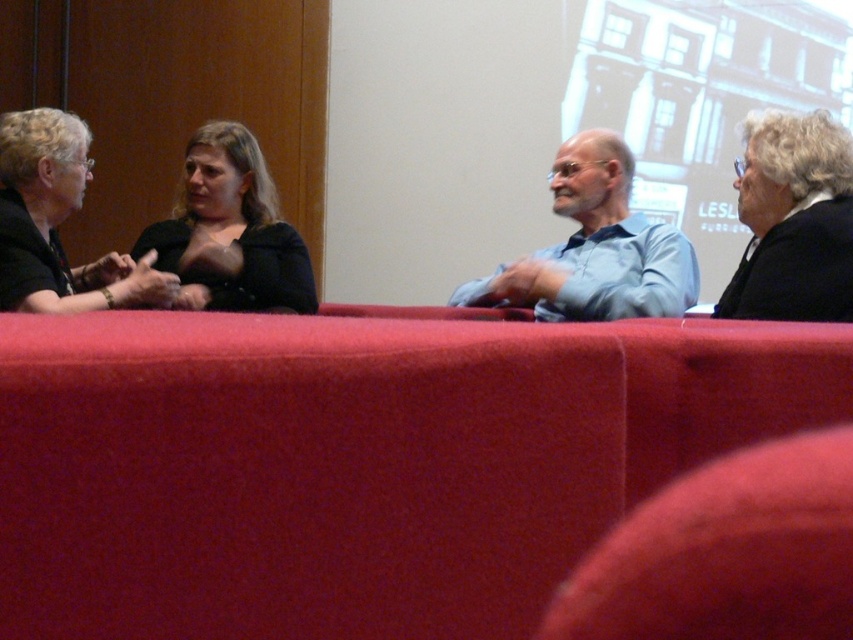
Measure the distance from black woolen jacket at right to matte black jacket at left.

A distance of 4.70 feet exists between black woolen jacket at right and matte black jacket at left.

Is black woolen jacket at right shorter than matte black jacket at left?

Correct, black woolen jacket at right is not as tall as matte black jacket at left.

Is point (837, 257) in front of point (20, 216)?

Yes, it is.

You are a GUI agent. You are given a task and a screenshot of the screen. Output one action in this format:
    pyautogui.click(x=<x>, y=<y>)
    Task: Click on the black woolen jacket at right
    
    Given the screenshot: What is the action you would take?
    pyautogui.click(x=793, y=220)

Can you confirm if light blue shirt at center is thinner than matte black jacket at left?

No.

Does light blue shirt at center appear under matte black jacket at left?

No, light blue shirt at center is not below matte black jacket at left.

Does point (486, 284) come farther from viewer compared to point (9, 148)?

Yes.

Find the location of a particular element. light blue shirt at center is located at coordinates (595, 248).

Consider the image. Is light blue shirt at center to the right of matte black shirt at center from the viewer's perspective?

Yes, light blue shirt at center is to the right of matte black shirt at center.

Which is above, light blue shirt at center or matte black shirt at center?

light blue shirt at center

Is point (593, 289) farther from camera compared to point (207, 276)?

No, (593, 289) is closer to viewer.

You are a GUI agent. You are given a task and a screenshot of the screen. Output one action in this format:
    pyautogui.click(x=<x>, y=<y>)
    Task: Click on the light blue shirt at center
    The height and width of the screenshot is (640, 853).
    Given the screenshot: What is the action you would take?
    pyautogui.click(x=595, y=248)